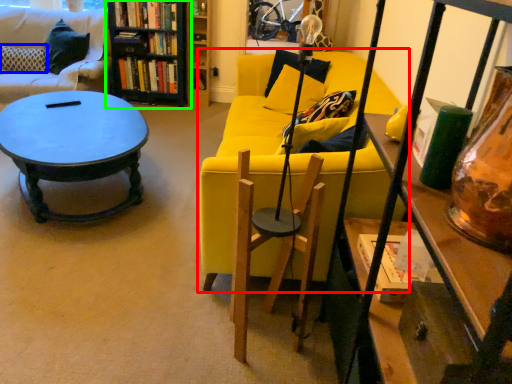
Question: Which object is the closest to the studio couch (highlighted by a red box)? Choose among these: pillow (highlighted by a blue box) or bookcase (highlighted by a green box).

Choices:
 (A) pillow
 (B) bookcase

Answer: (B)